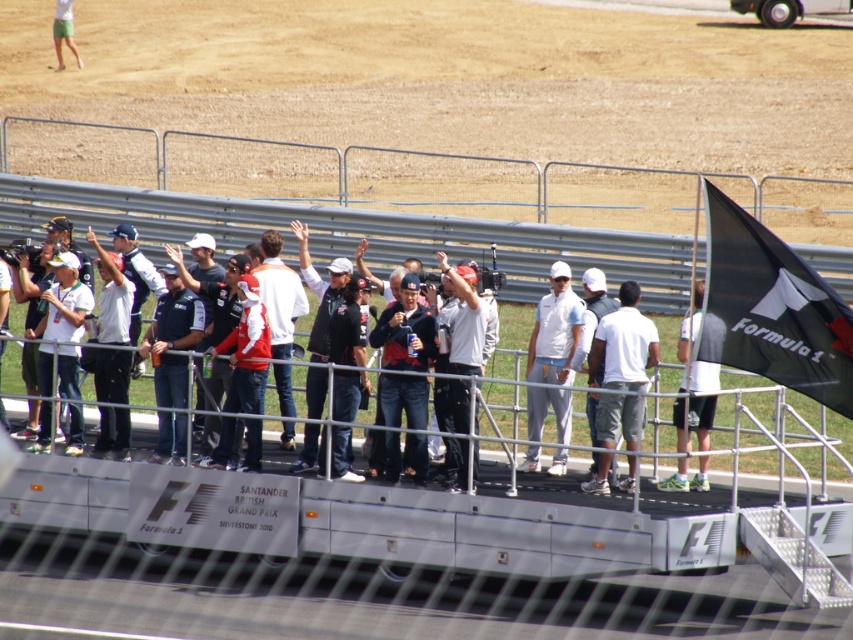
Which is more to the right, black fabric flag at right or reddish-white fabric jacket at center?

black fabric flag at right

Is point (804, 323) positioned after point (285, 278)?

No.

In order to click on black fabric flag at right in this screenshot , I will do `click(770, 308)`.

Does white cotton shirt at center come behind white fabric shirt at center?

Yes, it is.

This screenshot has height=640, width=853. I want to click on white cotton shirt at center, so click(x=624, y=344).

Find the location of a particular element. The width and height of the screenshot is (853, 640). white cotton shirt at center is located at coordinates (624, 344).

Is white fabric shirt at center bigger than white fabric cap at center?

Yes.

Between white fabric shirt at center and white fabric cap at center, which one is positioned lower?

white fabric cap at center is lower down.

Which is in front, point (695, 397) or point (590, 292)?

Positioned in front is point (695, 397).

Where is `white fabric shirt at center`? white fabric shirt at center is located at coordinates (689, 348).